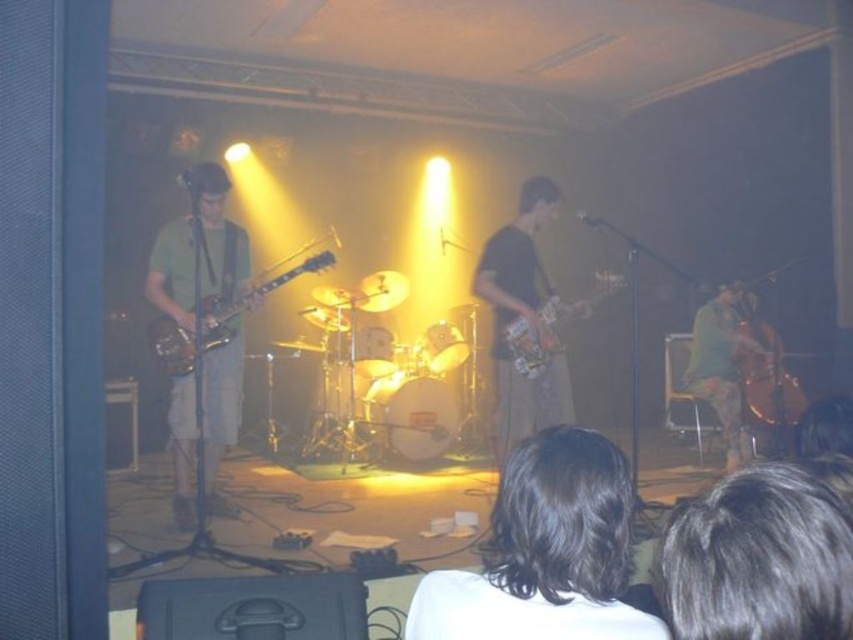
What do you see at coordinates (253, 296) in the screenshot?
I see `glossy wood guitar at left` at bounding box center [253, 296].

Image resolution: width=853 pixels, height=640 pixels. Describe the element at coordinates (253, 296) in the screenshot. I see `glossy wood guitar at left` at that location.

Where is `glossy wood guitar at left`? The height and width of the screenshot is (640, 853). glossy wood guitar at left is located at coordinates (253, 296).

Which is in front, point (173, 493) or point (695, 371)?

Point (173, 493) is more forward.

Who is more forward, (215, 168) or (688, 388)?

Point (215, 168)

You are a GUI agent. You are given a task and a screenshot of the screen. Output one action in this format:
    pyautogui.click(x=<x>, y=<y>)
    Task: Click on the matte green shirt at left
    The image size is (853, 640).
    Given the screenshot: What is the action you would take?
    pyautogui.click(x=199, y=252)

Consider the image. Is dark brown hair at lower center to the right of dark brown hair at lower right from the viewer's perspective?

No, dark brown hair at lower center is not to the right of dark brown hair at lower right.

Who is taller, dark brown hair at lower center or dark brown hair at lower right?

dark brown hair at lower center is taller.

The width and height of the screenshot is (853, 640). I want to click on dark brown hair at lower center, so click(x=544, y=552).